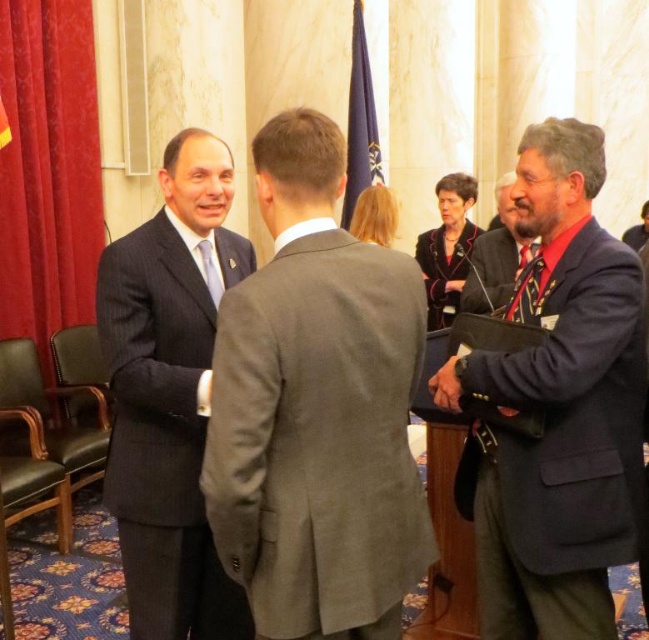
You are a photographer at the event and need to capture a photo of both the gray wool suit at center and the dark blue suit at center. Which one is located lower in the image?

The gray wool suit at center is positioned under the dark blue suit at center, so it is located lower in the image.

You are a photographer setting up for a group photo. You need to position two subjects wearing the dark blue suit at right and the matte black suit at right so that there is at least 2 feet between them. Based on their current positions, will you need to adjust their spacing?

The distance between the dark blue suit at right and the matte black suit at right is 24.44 inches, which is less than 2 feet. Therefore, you will need to move them further apart to meet the required spacing.

You are a photographer at the event and need to capture a group photo of the gray wool suit at center and dark blue suit at center. The camera you are using has a maximum focus range of 5 meters. Will you be able to take a clear photo of both individuals simultaneously?

The gray wool suit at center and dark blue suit at center are 6.06 meters apart from each other. Since the camera has a maximum focus range of 5 meters, the distance between them exceeds this limit. Therefore, you won